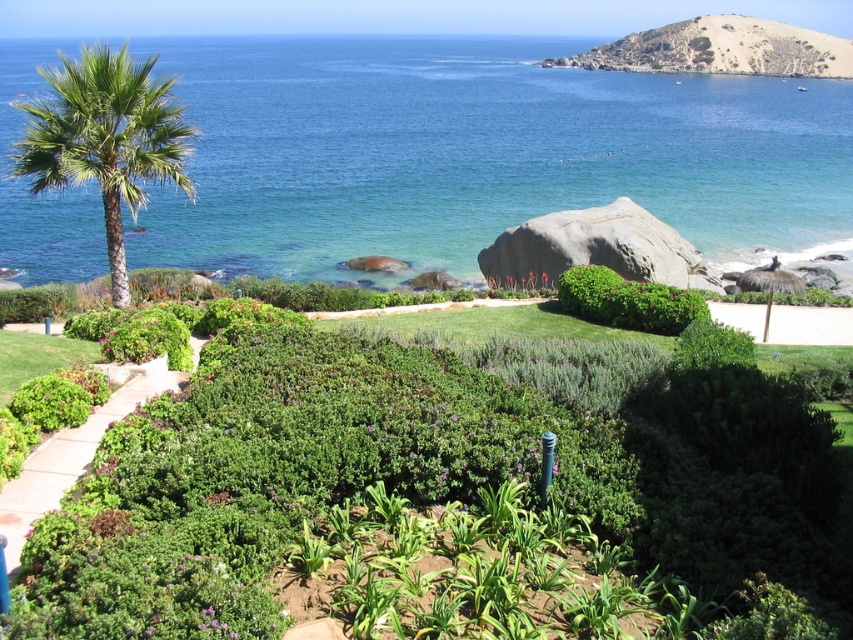
You are standing at the entrance of the garden and see the green grass at lower left and the green leafy bush at center. Which object is positioned more to the left side of the garden?

The green grass at lower left is positioned more to the left side of the garden than the green leafy bush at center.

You are standing at the garden entrance and want to reach the blue water at upper left. The path through the garden is 25 meters long. Will you reach the blue water before the path ends?

The blue water at upper left is 32.76 meters from camera. Since the path through the garden is only 25 meters long, you will not reach the blue water before the path ends.

You are a gardener who needs to water the green grass at lower left and the green leafy bush at center. Your watering can holds enough water to cover 10 meters. Can you water both without refilling?

The distance between the green grass at lower left and the green leafy bush at center is 10.74 meters, which is slightly more than the 10 meters your watering can can cover. Therefore, you will need to refill your watering can before watering both areas.